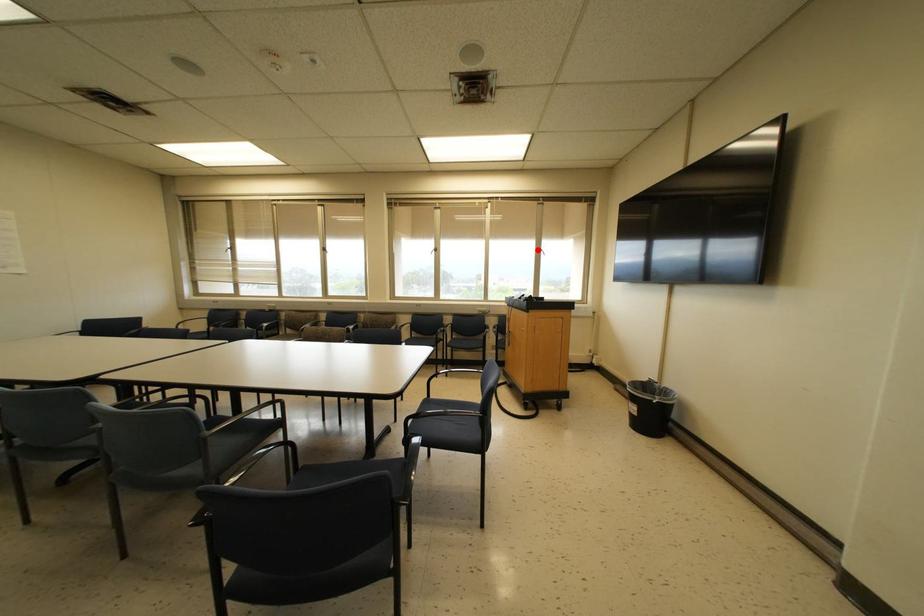
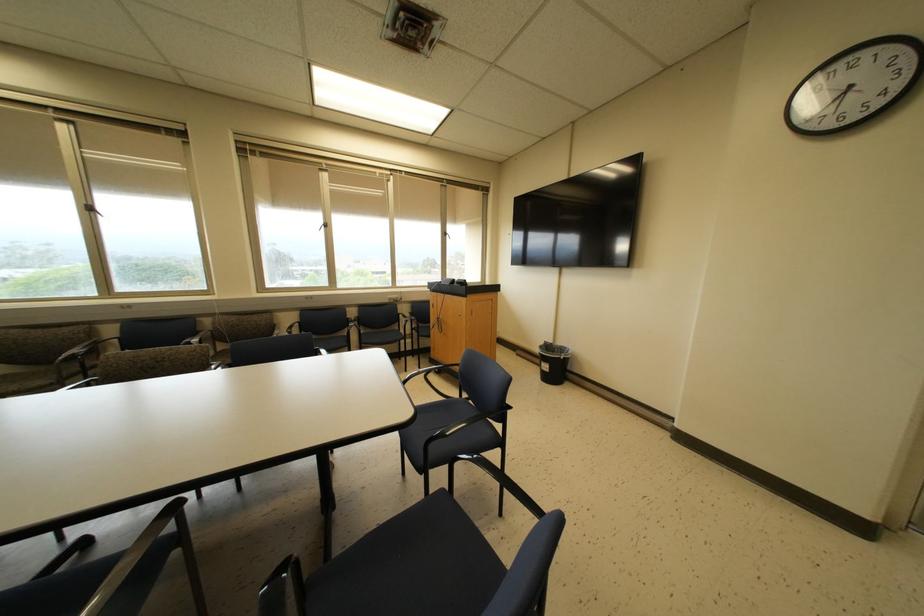
Question: I am providing you with two images of the same scene from different viewpoints. Given a red point in image1, look at the same physical point in image2. Is it:

Choices:
 (A) Closer to the viewpoint
 (B) Farther from the viewpoint

Answer: (A)